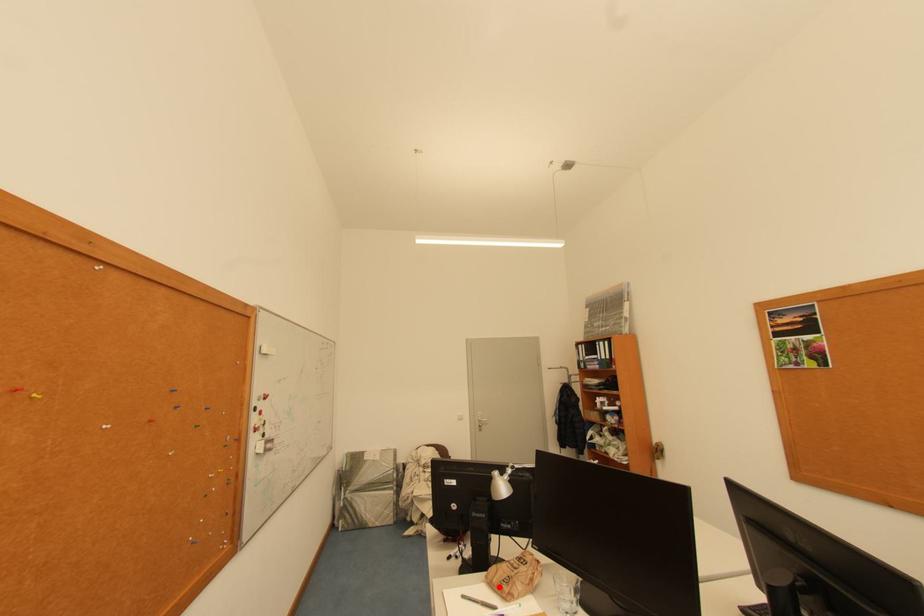
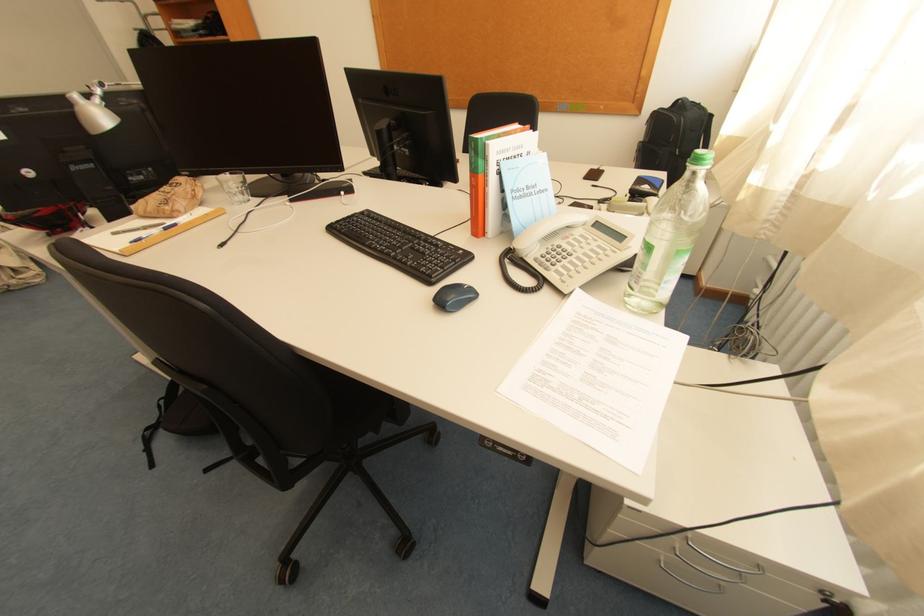
Find the pixel in the second image that matches the highlighted location in the first image.

(155, 217)